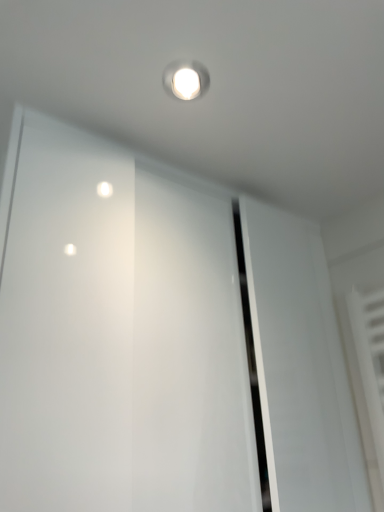
Question: In which direction should I rotate to look at transparent glass screen door at upper center?

Choices:
 (A) left
 (B) right

Answer: (A)